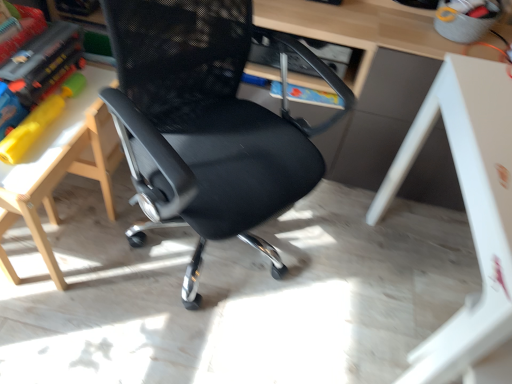
What do you see at coordinates (42, 62) in the screenshot? The height and width of the screenshot is (384, 512). I see `matte plastic book at left` at bounding box center [42, 62].

At what (x,y) coordinates should I click in order to perform the action: click on white glossy table at lower right, arranged as the first table when viewed from the right. Please return your answer as a coordinate pair (x, y). Image resolution: width=512 pixels, height=384 pixels. Looking at the image, I should click on (468, 216).

Can you confirm if matte plastic book at left is positioned to the left of white wood table at left, arranged as the 2th table when viewed from the right?

Correct, you'll find matte plastic book at left to the left of white wood table at left, arranged as the 2th table when viewed from the right.

Which point is more forward, (23, 94) or (87, 101)?

Positioned in front is point (23, 94).

Between matte plastic book at left and white wood table at left, arranged as the 2th table when viewed from the right, which one has larger width?

Wider between the two is white wood table at left, arranged as the 2th table when viewed from the right.

Consider the image. Would you say black mesh chair at center is part of white glossy table at lower right, which is counted as the 2th table, starting from the left,'s contents?

Actually, black mesh chair at center is outside white glossy table at lower right, which is counted as the 2th table, starting from the left.

Is white glossy table at lower right, arranged as the first table when viewed from the right, in front of or behind black mesh chair at center in the image?

white glossy table at lower right, arranged as the first table when viewed from the right, is behind black mesh chair at center.

Does white glossy table at lower right, arranged as the first table when viewed from the right, touch black mesh chair at center?

white glossy table at lower right, arranged as the first table when viewed from the right, and black mesh chair at center are not in contact.

Is white glossy table at lower right, which is counted as the 2th table, starting from the left, taller or shorter than black mesh chair at center?

Considering their sizes, white glossy table at lower right, which is counted as the 2th table, starting from the left, has less height than black mesh chair at center.

From a real-world perspective, is matte plastic book at left positioned above or below black mesh chair at center?

matte plastic book at left is situated higher than black mesh chair at center in the real world.

Based on the photo, considering the sizes of matte plastic book at left and black mesh chair at center in the image, is matte plastic book at left taller or shorter than black mesh chair at center?

Clearly, matte plastic book at left is shorter compared to black mesh chair at center.

Is black mesh chair at center located within matte plastic book at left?

Actually, black mesh chair at center is outside matte plastic book at left.

Is black mesh chair at center to the left of matte plastic book at left from the viewer's perspective?

In fact, black mesh chair at center is to the right of matte plastic book at left.

Identify the location of book on the left side of black mesh chair at center. The height and width of the screenshot is (384, 512). (42, 62).

From a real-world perspective, who is located higher, black mesh chair at center or matte plastic book at left?

matte plastic book at left, from a real-world perspective.

Is the surface of black mesh chair at center in direct contact with matte plastic book at left?

They are not placed beside each other.

Does white wood table at left, arranged as the 1th table when viewed from the left, have a greater width compared to black mesh chair at center?

Yes, white wood table at left, arranged as the 1th table when viewed from the left, is wider than black mesh chair at center.

From the image's perspective, is white wood table at left, arranged as the 1th table when viewed from the left, above black mesh chair at center?

No, from the image's perspective, white wood table at left, arranged as the 1th table when viewed from the left, is not on top of black mesh chair at center.

From a real-world perspective, is white wood table at left, arranged as the 1th table when viewed from the left, physically located above or below black mesh chair at center?

white wood table at left, arranged as the 1th table when viewed from the left, is below black mesh chair at center.

Consider the image. Is white wood table at left, arranged as the 1th table when viewed from the left, far away from black mesh chair at center?

No.

Looking at this image, would you say white glossy table at lower right, which is counted as the 2th table, starting from the left, contains white wood table at left, arranged as the 1th table when viewed from the left?

No, white wood table at left, arranged as the 1th table when viewed from the left, is not a part of white glossy table at lower right, which is counted as the 2th table, starting from the left.

From the image's perspective, is white glossy table at lower right, arranged as the first table when viewed from the right, located above white wood table at left, arranged as the 2th table when viewed from the right?

No.

Visually, is white glossy table at lower right, arranged as the first table when viewed from the right, positioned to the left or to the right of white wood table at left, arranged as the 1th table when viewed from the left?

In the image, white glossy table at lower right, arranged as the first table when viewed from the right, appears on the right side of white wood table at left, arranged as the 1th table when viewed from the left.

In the image, is white glossy table at lower right, which is counted as the 2th table, starting from the left, positioned in front of or behind white wood table at left, arranged as the 2th table when viewed from the right?

white glossy table at lower right, which is counted as the 2th table, starting from the left, is in front of white wood table at left, arranged as the 2th table when viewed from the right.

Is white wood table at left, arranged as the 1th table when viewed from the left, wider or thinner than matte plastic book at left?

Considering their sizes, white wood table at left, arranged as the 1th table when viewed from the left, looks broader than matte plastic book at left.

Is point (114, 78) farther from viewer compared to point (42, 44)?

Yes, point (114, 78) is farther from viewer.

Which object is closer to the camera, white wood table at left, arranged as the 2th table when viewed from the right, or matte plastic book at left?

white wood table at left, arranged as the 2th table when viewed from the right.

What's the angular difference between white wood table at left, arranged as the 2th table when viewed from the right, and matte plastic book at left's facing directions?

91 degrees.

You are a GUI agent. You are given a task and a screenshot of the screen. Output one action in this format:
    pyautogui.click(x=<x>, y=<y>)
    Task: Click on the book above the white wood table at left, arranged as the 2th table when viewed from the right (from a real-world perspective)
    The image size is (512, 384).
    Given the screenshot: What is the action you would take?
    pyautogui.click(x=42, y=62)

Locate an element on the screen. the 1st table behind the black mesh chair at center, starting your count from the anchor is located at coordinates (468, 216).

Considering their positions, is matte plastic book at left positioned further to white wood table at left, arranged as the 1th table when viewed from the left, than black mesh chair at center?

The object further to white wood table at left, arranged as the 1th table when viewed from the left, is black mesh chair at center.

From the image, which object appears to be nearer to white wood table at left, arranged as the 2th table when viewed from the right, white glossy table at lower right, which is counted as the 2th table, starting from the left, or matte plastic book at left?

matte plastic book at left lies closer to white wood table at left, arranged as the 2th table when viewed from the right, than the other object.

Which object lies nearer to the anchor point black mesh chair at center, white glossy table at lower right, arranged as the first table when viewed from the right, or white wood table at left, arranged as the 1th table when viewed from the left?

white wood table at left, arranged as the 1th table when viewed from the left, is positioned closer to the anchor black mesh chair at center.

When comparing their distances from matte plastic book at left, does black mesh chair at center or white glossy table at lower right, arranged as the first table when viewed from the right, seem further?

Among the two, white glossy table at lower right, arranged as the first table when viewed from the right, is located further to matte plastic book at left.

Which object lies nearer to the anchor point matte plastic book at left, white wood table at left, arranged as the 2th table when viewed from the right, or black mesh chair at center?

white wood table at left, arranged as the 2th table when viewed from the right.

When comparing their distances from black mesh chair at center, does white wood table at left, arranged as the 2th table when viewed from the right, or white glossy table at lower right, arranged as the first table when viewed from the right, seem closer?

white wood table at left, arranged as the 2th table when viewed from the right, lies closer to black mesh chair at center than the other object.

Based on their spatial positions, is white glossy table at lower right, which is counted as the 2th table, starting from the left, or matte plastic book at left closer to black mesh chair at center?

Among the two, matte plastic book at left is located nearer to black mesh chair at center.

From the image, which object appears to be nearer to matte plastic book at left, white glossy table at lower right, arranged as the first table when viewed from the right, or white wood table at left, arranged as the 1th table when viewed from the left?

Among the two, white wood table at left, arranged as the 1th table when viewed from the left, is located nearer to matte plastic book at left.

The image size is (512, 384). I want to click on table located between matte plastic book at left and white glossy table at lower right, which is counted as the 2th table, starting from the left, in the left-right direction, so click(x=63, y=163).

At what (x,y) coordinates should I click in order to perform the action: click on chair between white wood table at left, arranged as the 2th table when viewed from the right, and white glossy table at lower right, which is counted as the 2th table, starting from the left. Please return your answer as a coordinate pair (x, y). Looking at the image, I should click on (207, 123).

At what (x,y) coordinates should I click in order to perform the action: click on table located between matte plastic book at left and black mesh chair at center in the left-right direction. Please return your answer as a coordinate pair (x, y). The width and height of the screenshot is (512, 384). Looking at the image, I should click on (63, 163).

Where is `chair situated between matte plastic book at left and white glossy table at lower right, which is counted as the 2th table, starting from the left, from left to right`? The image size is (512, 384). chair situated between matte plastic book at left and white glossy table at lower right, which is counted as the 2th table, starting from the left, from left to right is located at coordinates (207, 123).